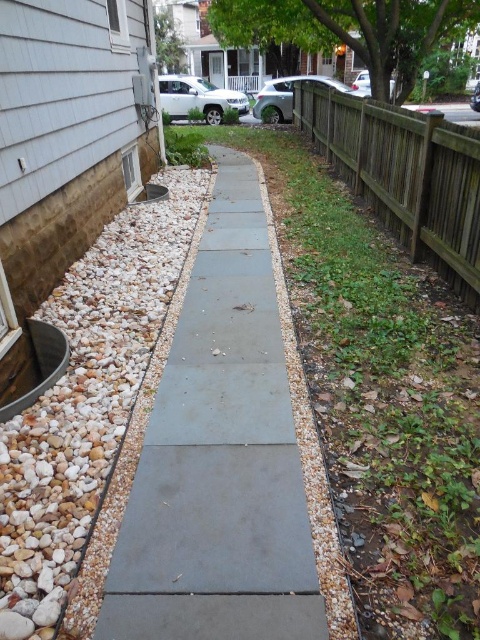
You are a gardener planning to install a new flower bed between the gray concrete path at center and the brown wooden fence at right. Based on their positions, which object should you start working closer to the house?

The gray concrete path at center is to the left of the brown wooden fence at right, so you should start working closer to the house near the gray concrete path at center since it is positioned closer to the house compared to the fence.

You are a gardener planning to walk from the house to the end of the gray concrete path at center. There is white gravel at left next to the path. Which surface will you step on first when leaving the house?

The gray concrete path at center is thinner than the white gravel at left, so you will step onto the white gravel at left first before reaching the gray concrete path at center.